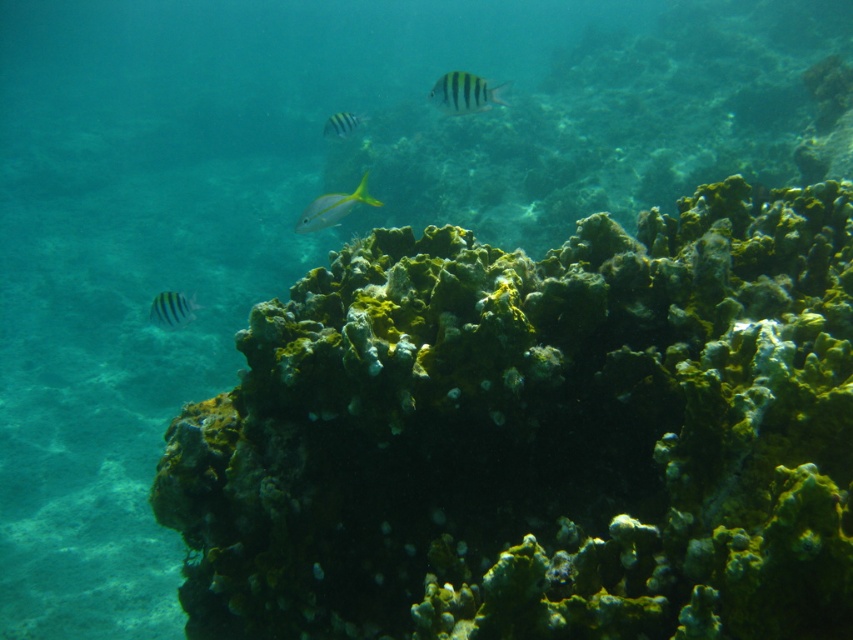
You are a scuba diver with a 6 feet long underwater camera. You are positioned at the point marked as point [363,202]. You want to take a photo of the coral formations in the foreground. Can your camera reach the corals without moving your position?

The distance between point [363,202] and the viewer is 11.13 feet. Since the camera is only 6 feet long, it cannot reach the corals from your current position.